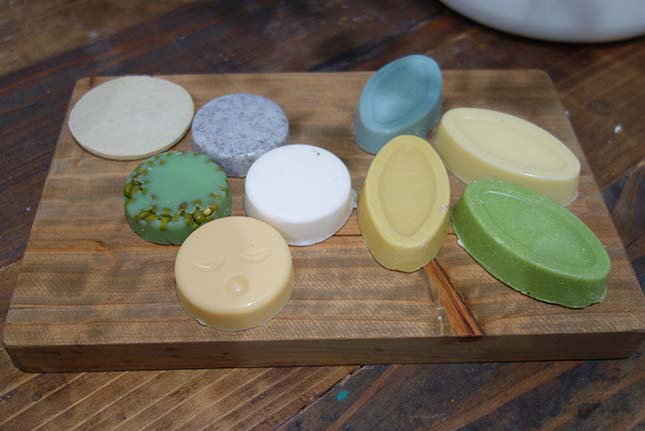
The height and width of the screenshot is (431, 645). Identify the location of soap with stuff in it. [x=188, y=173], [x=260, y=119].